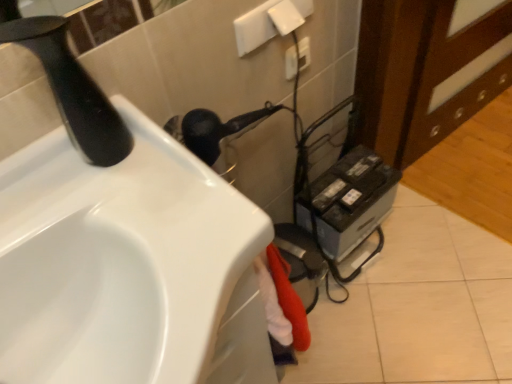
Question: Can you confirm if metallic gray printer at lower right is bigger than white plastic electric outlet at upper center?

Choices:
 (A) no
 (B) yes

Answer: (B)

Question: Can you confirm if metallic gray printer at lower right is smaller than white plastic electric outlet at upper center?

Choices:
 (A) no
 (B) yes

Answer: (A)

Question: From a real-world perspective, is metallic gray printer at lower right located higher than white plastic electric outlet at upper center?

Choices:
 (A) no
 (B) yes

Answer: (A)

Question: From the image's perspective, does metallic gray printer at lower right appear lower than white plastic electric outlet at upper center?

Choices:
 (A) no
 (B) yes

Answer: (B)

Question: Considering the relative positions of metallic gray printer at lower right and white plastic electric outlet at upper center in the image provided, is metallic gray printer at lower right to the left of white plastic electric outlet at upper center from the viewer's perspective?

Choices:
 (A) no
 (B) yes

Answer: (A)

Question: Would you say black matte faucet at upper left is inside or outside white plastic electric outlet at upper center?

Choices:
 (A) outside
 (B) inside

Answer: (A)

Question: From the image's perspective, relative to white plastic electric outlet at upper center, is black matte faucet at upper left above or below?

Choices:
 (A) below
 (B) above

Answer: (A)

Question: Considering the relative positions of black matte faucet at upper left and white plastic electric outlet at upper center in the image provided, is black matte faucet at upper left to the left or to the right of white plastic electric outlet at upper center?

Choices:
 (A) right
 (B) left

Answer: (B)

Question: Is black matte faucet at upper left wider or thinner than white plastic electric outlet at upper center?

Choices:
 (A) wide
 (B) thin

Answer: (A)

Question: Is point (158, 299) closer or farther from the camera than point (62, 66)?

Choices:
 (A) farther
 (B) closer

Answer: (B)

Question: Visually, is white glossy sink at lower left positioned to the left or to the right of black matte faucet at upper left?

Choices:
 (A) right
 (B) left

Answer: (A)

Question: In terms of height, does white glossy sink at lower left look taller or shorter compared to black matte faucet at upper left?

Choices:
 (A) short
 (B) tall

Answer: (B)

Question: From a real-world perspective, is white glossy sink at lower left positioned above or below black matte faucet at upper left?

Choices:
 (A) above
 (B) below

Answer: (B)

Question: Looking at the image, does black matte faucet at upper left seem bigger or smaller compared to metallic gray printer at lower right?

Choices:
 (A) big
 (B) small

Answer: (B)

Question: Looking at their shapes, would you say black matte faucet at upper left is wider or thinner than metallic gray printer at lower right?

Choices:
 (A) thin
 (B) wide

Answer: (A)